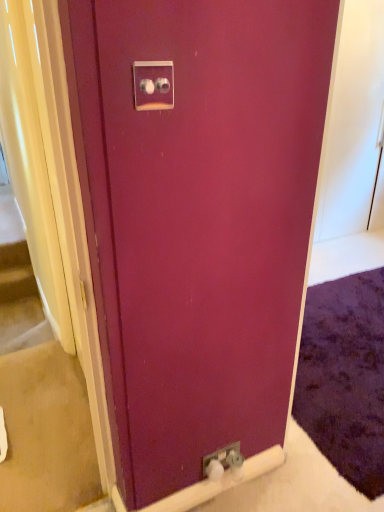
Question: From the image's perspective, is beige carpet at lower left above or below satin silver switch at upper center, the 1th electric outlet from the top?

Choices:
 (A) below
 (B) above

Answer: (A)

Question: From a real-world perspective, is beige carpet at lower left above or below satin silver switch at upper center, marked as the first electric outlet in a left-to-right arrangement?

Choices:
 (A) below
 (B) above

Answer: (A)

Question: Estimate the real-world distances between objects in this image. Which object is farther from the satin silver switch at upper center, the 1th electric outlet from the top?

Choices:
 (A) metallic silver outlet at lower center, which is the second electric outlet from front to back
 (B) beige carpet at lower left

Answer: (B)

Question: Which object is positioned farthest from the metallic silver outlet at lower center, the first electric outlet positioned from the bottom?

Choices:
 (A) beige carpet at lower left
 (B) satin silver switch at upper center, the second electric outlet from the bottom

Answer: (B)